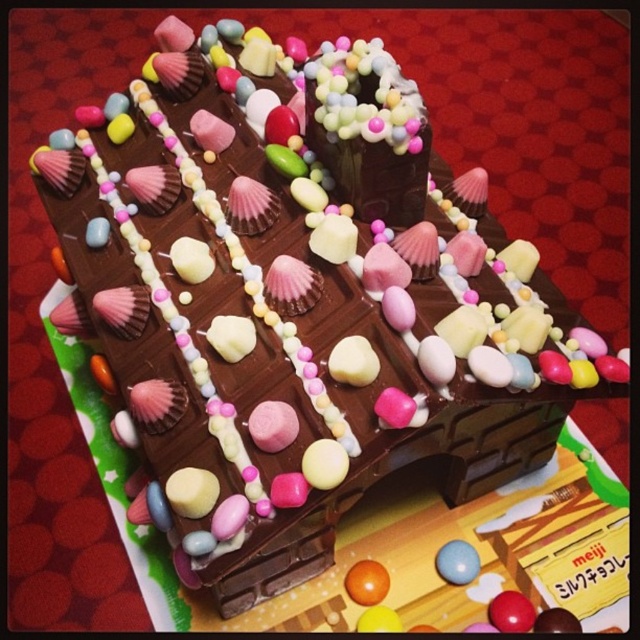
You are a cake decorator who needs to adjust the height of the decorations on the chocolate cake shaped like the number 9. You have the orange glossy candy at center and the matte blue sphere at center. Which decoration should you replace if you want to increase the overall height of the cake?

The orange glossy candy at center is shorter than the matte blue sphere at center, so you should replace the orange glossy candy at center to increase the overall height of the cake.

Looking at the chocolate cake shaped like the number 9, which candy is positioned lower between the orange glossy candy at center and the matte blue sphere at center?

The orange glossy candy at center is positioned below the matte blue sphere at center, so it is the lower one.